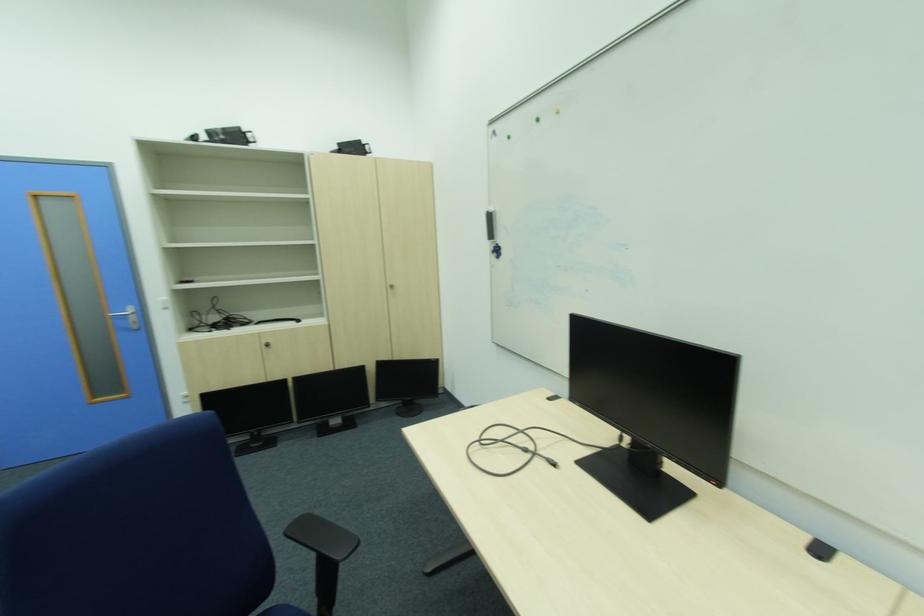
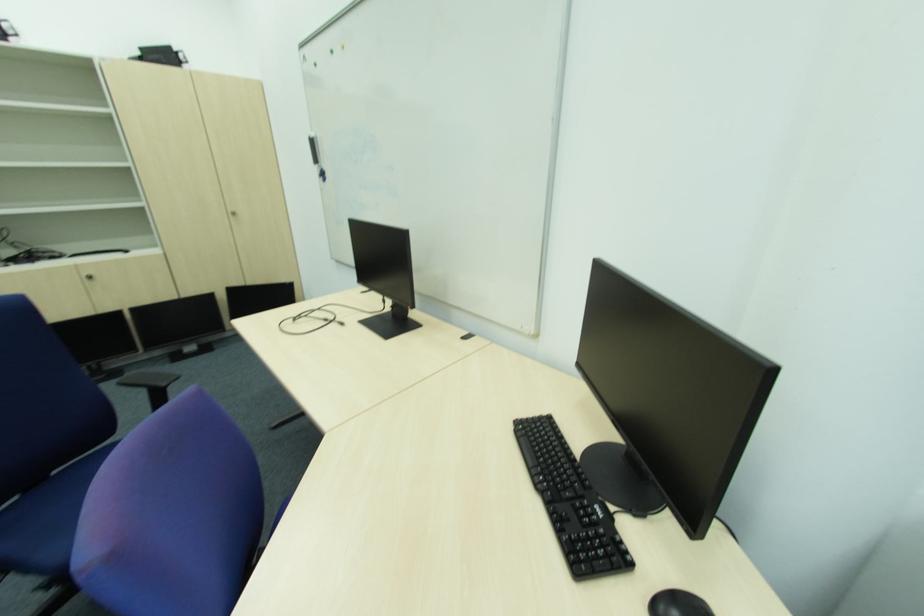
Question: The first image is from the beginning of the video and the second image is from the end. How did the camera likely rotate when shooting the video?

Choices:
 (A) Left
 (B) Right
 (C) Up
 (D) Down

Answer: (B)